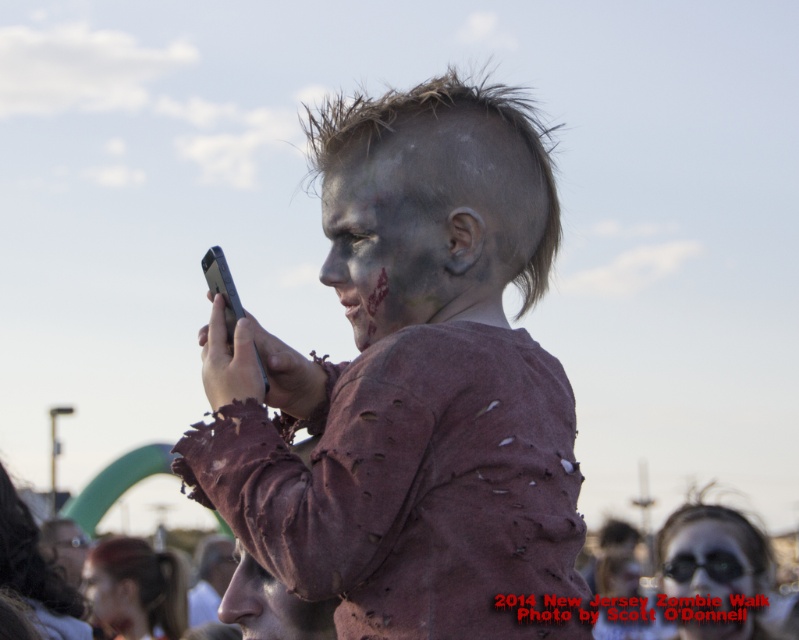
Question: Is gray matte face at center above matte gray face at center?

Choices:
 (A) yes
 (B) no

Answer: (A)

Question: Which object is closer to the camera taking this photo?

Choices:
 (A) matte gray face at center
 (B) gray matte face at center
 (C) matte gray face paint at center

Answer: (A)

Question: Which point is closer to the camera taking this photo?

Choices:
 (A) (94, 595)
 (B) (273, 596)
 (C) (364, 186)
 (D) (539, 442)

Answer: (D)

Question: Which object is the closest to the matte brown shirt at center?

Choices:
 (A) matte gray face paint at center
 (B) gray matte face at center
 (C) white matte face paint at center
 (D) matte gray face at center

Answer: (B)

Question: Is white matte face paint at center to the right of matte gray face paint at center from the viewer's perspective?

Choices:
 (A) no
 (B) yes

Answer: (B)

Question: Is matte brown shirt at center above white matte face paint at center?

Choices:
 (A) yes
 (B) no

Answer: (A)